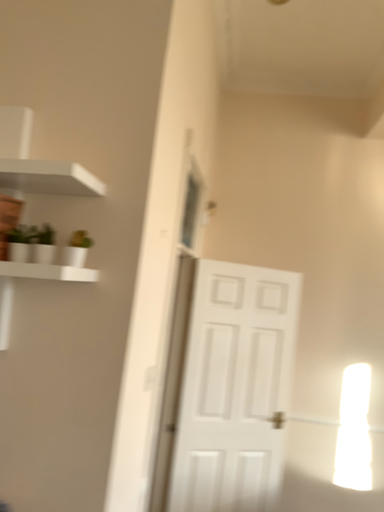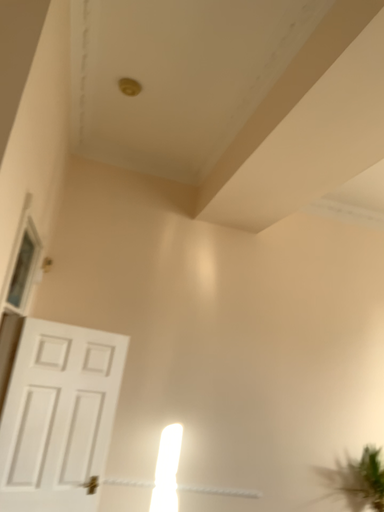
Question: How did the camera likely rotate when shooting the video?

Choices:
 (A) rotated downward
 (B) rotated upward

Answer: (B)